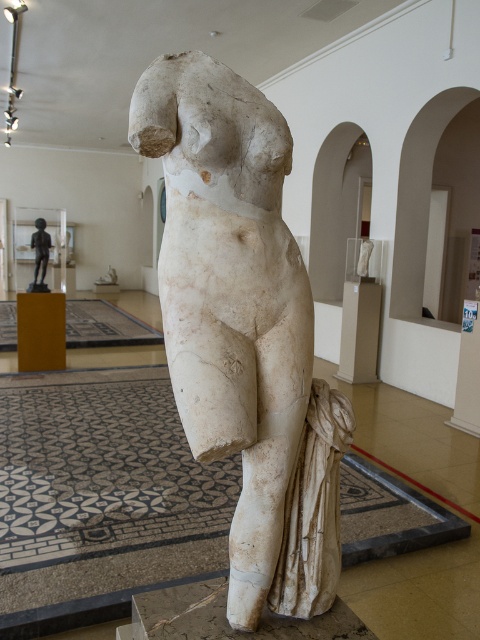
Who is higher up, white marble statue at center or bronze figure at left?

bronze figure at left

Does white marble statue at center have a lesser height compared to bronze figure at left?

In fact, white marble statue at center may be taller than bronze figure at left.

This screenshot has height=640, width=480. What do you see at coordinates (242, 326) in the screenshot?
I see `white marble statue at center` at bounding box center [242, 326].

At what (x,y) coordinates should I click in order to perform the action: click on white marble statue at center. Please return your answer as a coordinate pair (x, y). The image size is (480, 640). Looking at the image, I should click on (242, 326).